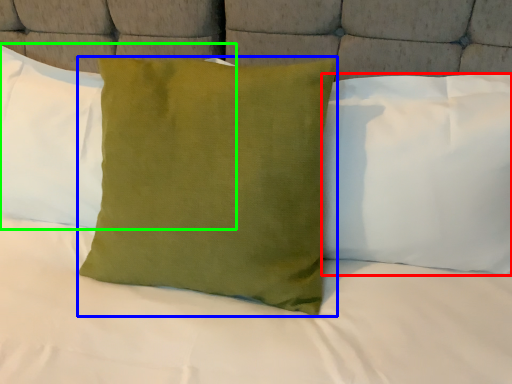
Question: Which is nearer to the pillow (highlighted by a red box)? pillow (highlighted by a blue box) or pillow (highlighted by a green box).

Choices:
 (A) pillow
 (B) pillow

Answer: (A)